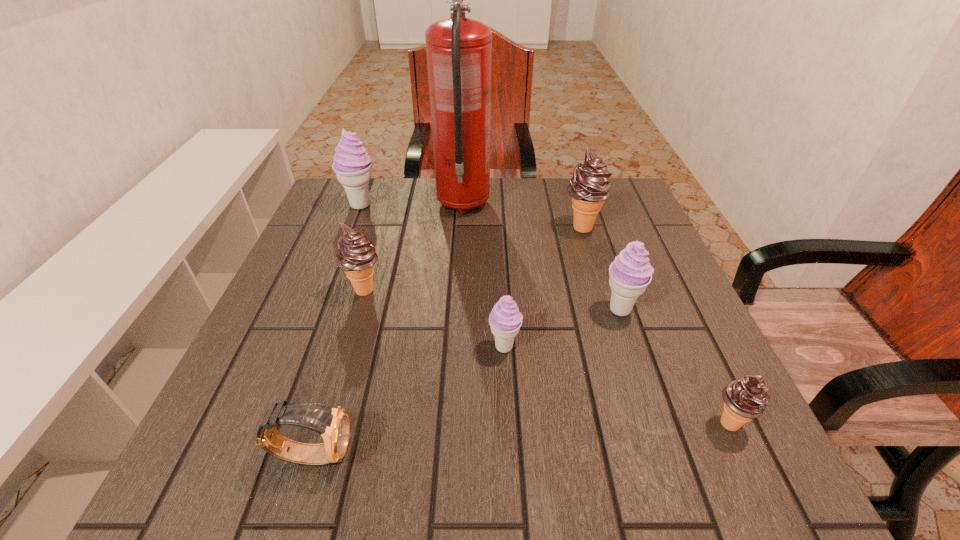
In the image, there is a desktop. Where is `vacant space at the right edge`? This screenshot has width=960, height=540. vacant space at the right edge is located at coordinates (718, 357).

This screenshot has height=540, width=960. Find the location of `blank space at the far left corner of the desktop`. blank space at the far left corner of the desktop is located at coordinates (337, 225).

Find the location of `vacant space at the near left corner of the desktop`. vacant space at the near left corner of the desktop is located at coordinates (191, 494).

The image size is (960, 540). I want to click on vacant space at the far right corner of the desktop, so click(x=624, y=199).

Locate an element on the screen. empty space that is in between the second farthest icecream and the tallest object is located at coordinates (523, 216).

What are the coordinates of `empty space between the second smallest purple icecream and the watch` in the screenshot? It's located at (467, 382).

This screenshot has height=540, width=960. What are the coordinates of `empty space between the watch and the smallest purple icecream` in the screenshot? It's located at (408, 400).

Locate an element on the screen. vacant space in between the second smallest chocolate icecream and the gold watch is located at coordinates (338, 372).

Where is `free spot between the red fire extinguisher and the rightmost purple icecream`? free spot between the red fire extinguisher and the rightmost purple icecream is located at coordinates (541, 257).

This screenshot has width=960, height=540. Find the location of `empty space that is in between the nearest icecream and the fire extinguisher`. empty space that is in between the nearest icecream and the fire extinguisher is located at coordinates (596, 314).